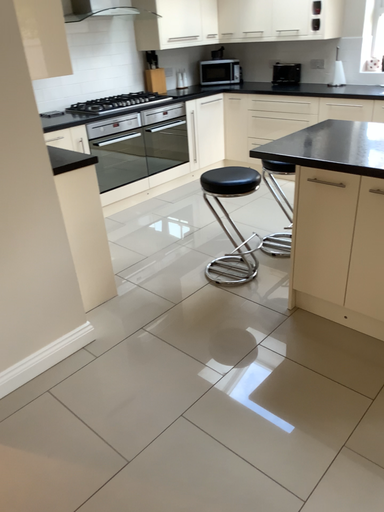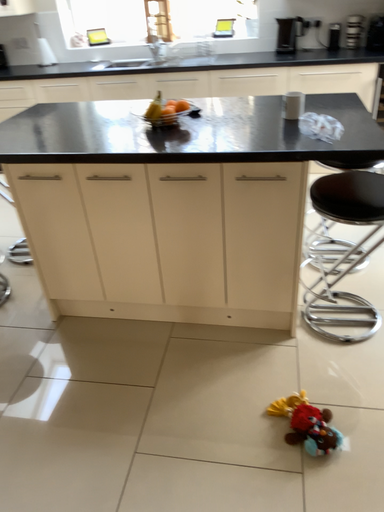
Question: How did the camera likely rotate when shooting the video?

Choices:
 (A) rotated left
 (B) rotated right

Answer: (B)